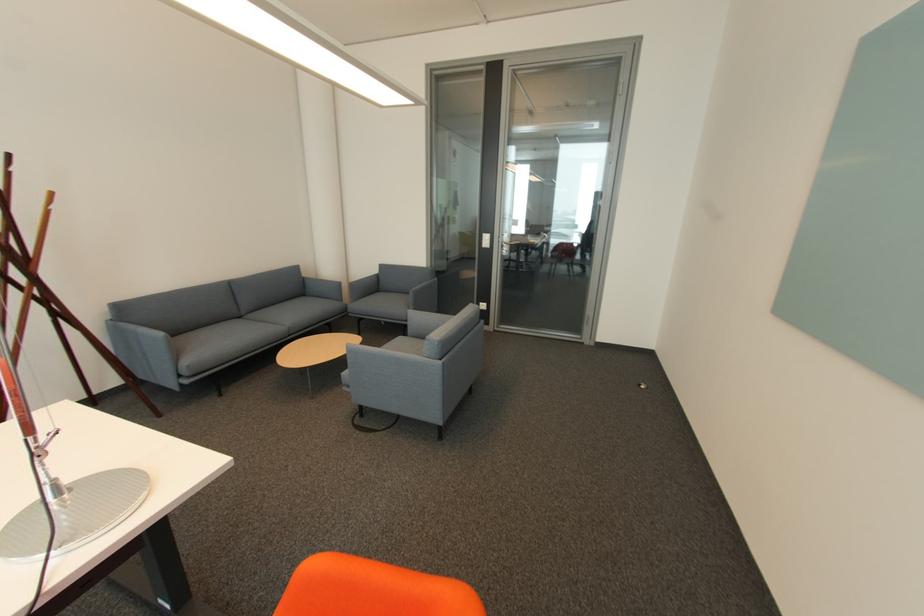
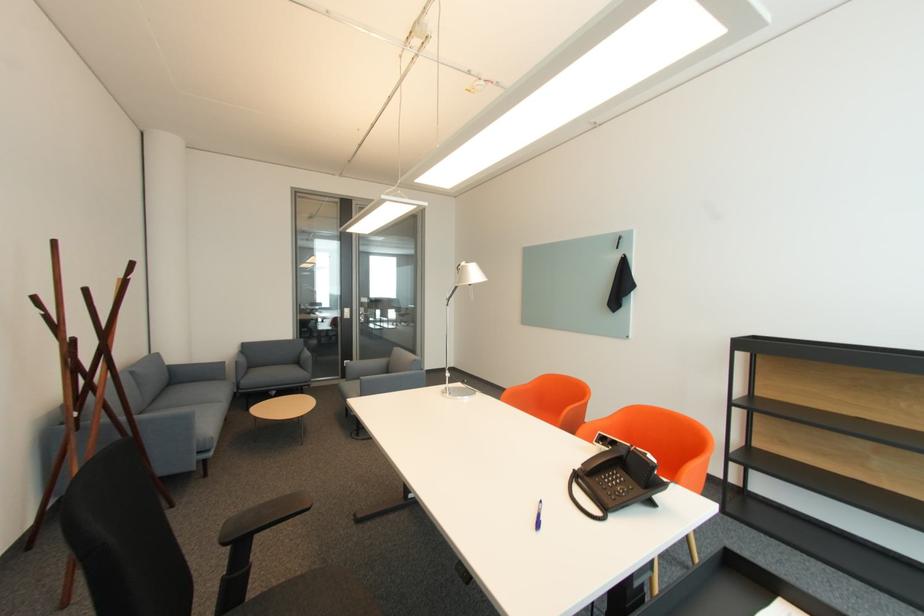
Find the pixel in the second image that matches point 249,317 in the first image.

(151, 411)